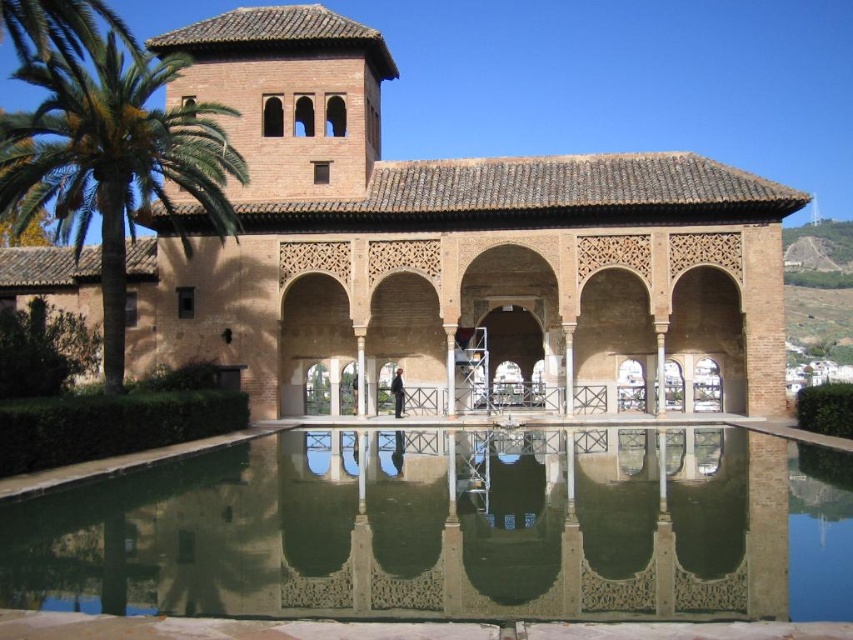
You are planning to take a photo of the brown textured palace at center and the green leafy palm tree at left. To ensure both fit in the frame, you need to know which object is wider. Which one is wider?

The brown textured palace at center is wider than the green leafy palm tree at left.

You are standing at the entrance of the Moorish building and see two points marked in the scene. The first point is at coordinates point (x=134, y=573) and the second is at point (x=238, y=156). Which point is closer to you as you face the building?

Point (x=134, y=573) is closer to you because it is in front of point (x=238, y=156) when facing the building.